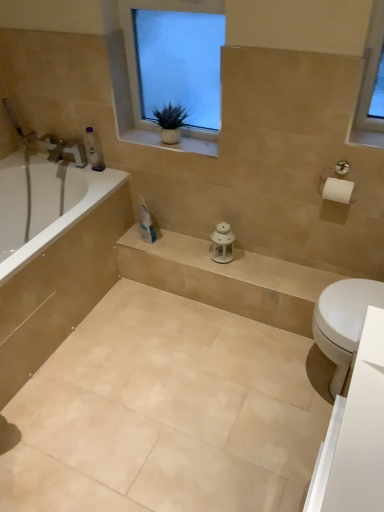
This screenshot has height=512, width=384. I want to click on vacant space situated above beige stone balustrade at center (from a real-world perspective), so click(x=237, y=257).